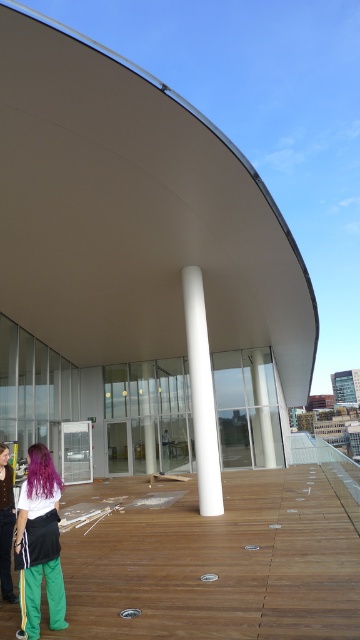
You are standing on the wooden deck and see two people with purple hair. Which one is positioned more to the left between the matte purple hair at lower left and the purple hair at center?

The purple hair at center is positioned more to the left than the matte purple hair at lower left because the matte purple hair at lower left is to the right of purple hair at center.

In the scene shown: You are a photographer trying to capture both the matte purple hair at lower left and the purple silky hair at lower left in the same frame. Which hair style will appear bigger in the photo?

The matte purple hair at lower left will appear bigger in the photo because it is larger in size than the purple silky hair at lower left.